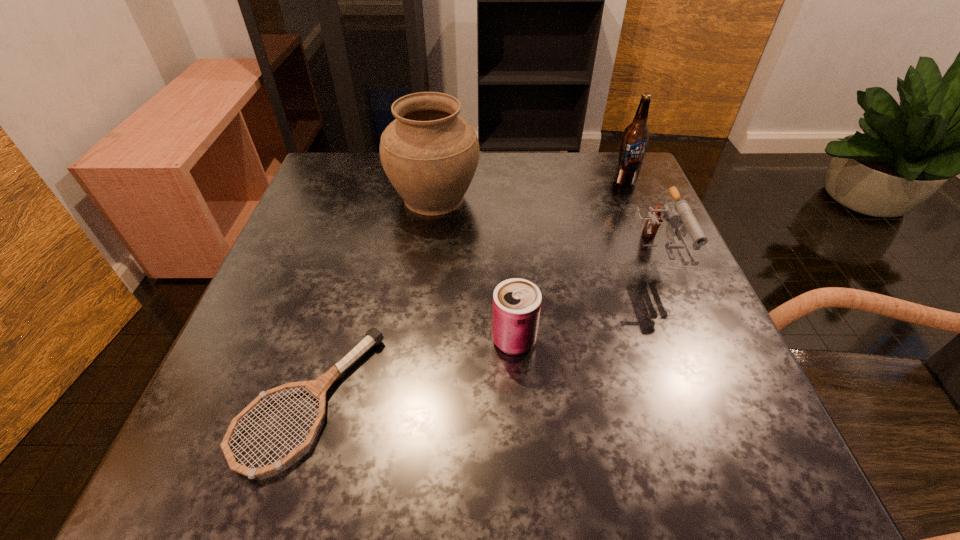
Locate an element on the screen. The image size is (960, 540). vacant region between the urn and the shortest object is located at coordinates (372, 299).

Image resolution: width=960 pixels, height=540 pixels. Find the location of `vacant point located between the beer bottle and the tennis racket`. vacant point located between the beer bottle and the tennis racket is located at coordinates (468, 291).

Image resolution: width=960 pixels, height=540 pixels. I want to click on free point between the shortest object and the can, so click(412, 370).

At what (x,y) coordinates should I click in order to perform the action: click on free area in between the shortest object and the beer bottle. Please return your answer as a coordinate pair (x, y). This screenshot has height=540, width=960. Looking at the image, I should click on (468, 291).

The height and width of the screenshot is (540, 960). I want to click on vacant space that is in between the beer bottle and the second shortest object, so click(x=569, y=260).

At what (x,y) coordinates should I click in order to perform the action: click on free spot between the gun and the urn. Please return your answer as a coordinate pair (x, y). The height and width of the screenshot is (540, 960). Looking at the image, I should click on (543, 229).

Identify which object is located as the second nearest to the tennis racket. Please provide its 2D coordinates. Your answer should be formatted as a tuple, i.e. [(x, y)], where the tuple contains the x and y coordinates of a point satisfying the conditions above.

[(430, 154)]

The height and width of the screenshot is (540, 960). What are the coordinates of `object that is the fourth closest one to the urn` in the screenshot? It's located at (636, 135).

Find the location of a particular element. The height and width of the screenshot is (540, 960). vacant area that satisfies the following two spatial constraints: 1. on the front side of the fourth tallest object; 2. on the right side of the urn is located at coordinates (416, 340).